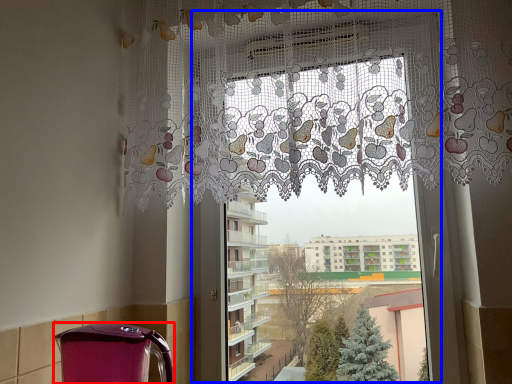
Question: Which of the following is the farthest to the observer, appliance (highlighted by a red box) or window frame (highlighted by a blue box)?

Choices:
 (A) appliance
 (B) window frame

Answer: (B)